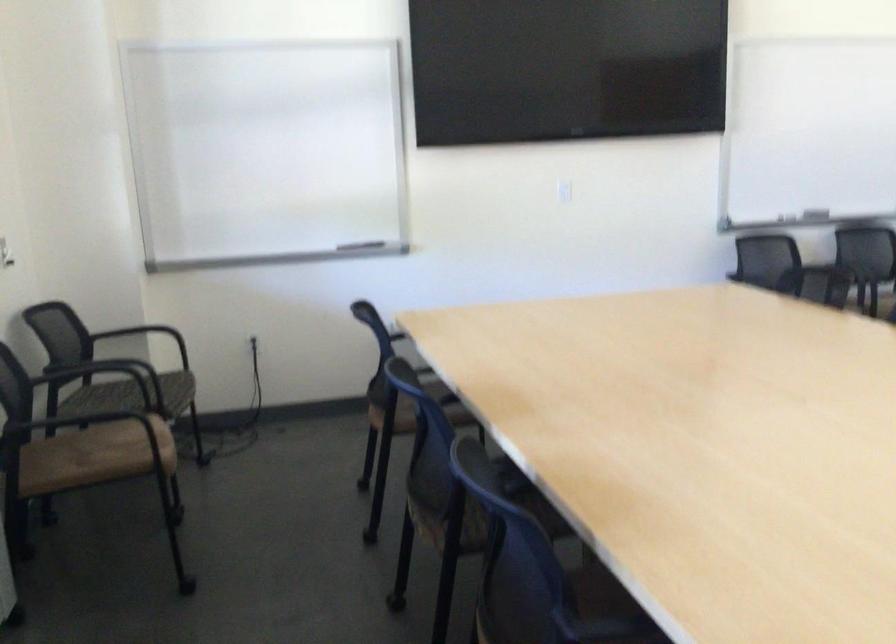
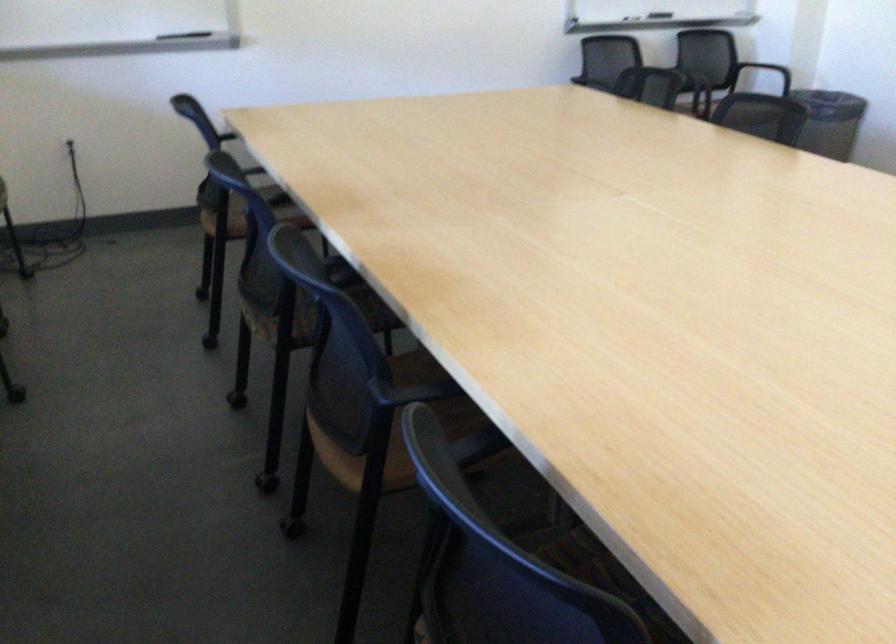
Find the pixel in the second image that matches point 300,238 in the first image.

(115, 26)